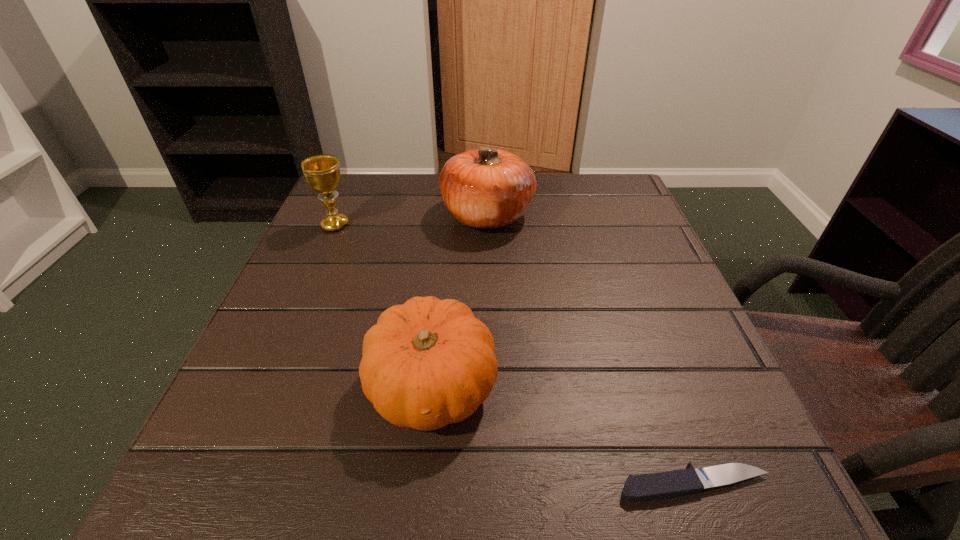
The image size is (960, 540). In the image, there is a desktop. What are the coordinates of `free region at the left edge` in the screenshot? It's located at (233, 376).

Identify the location of free point at the right edge. This screenshot has height=540, width=960. (656, 261).

You are a GUI agent. You are given a task and a screenshot of the screen. Output one action in this format:
    pyautogui.click(x=<x>, y=<y>)
    Task: Click on the vacant space at the far left corner of the desktop
    
    Given the screenshot: What is the action you would take?
    pyautogui.click(x=387, y=177)

Where is `free space between the nearer pumpkin and the leftmost object`? free space between the nearer pumpkin and the leftmost object is located at coordinates (384, 306).

The height and width of the screenshot is (540, 960). I want to click on free space between the chalice and the shortest object, so click(x=515, y=355).

Image resolution: width=960 pixels, height=540 pixels. I want to click on vacant point located between the rightmost object and the nearer pumpkin, so click(x=564, y=435).

Identify the location of vacant area between the nearer pumpkin and the shortest object. (564, 435).

This screenshot has height=540, width=960. What are the coordinates of `free space that is in between the chalice and the shortest object` in the screenshot? It's located at (515, 355).

Where is `blank region between the farther pumpkin and the chalice`? blank region between the farther pumpkin and the chalice is located at coordinates (411, 220).

The height and width of the screenshot is (540, 960). Identify the location of vacant area between the second shortest object and the nearest object. (564, 435).